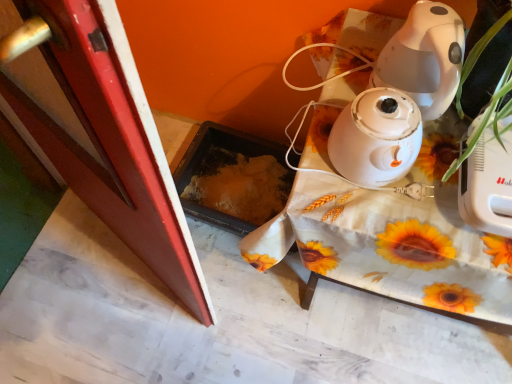
Question: Is green leafy plant at right placed right next to smooth red screen door at left?

Choices:
 (A) yes
 (B) no

Answer: (B)

Question: Is green leafy plant at right closer to camera compared to smooth red screen door at left?

Choices:
 (A) yes
 (B) no

Answer: (A)

Question: Is green leafy plant at right smaller than smooth red screen door at left?

Choices:
 (A) yes
 (B) no

Answer: (A)

Question: Is smooth red screen door at left located within green leafy plant at right?

Choices:
 (A) no
 (B) yes

Answer: (A)

Question: From the image's perspective, is green leafy plant at right located above smooth red screen door at left?

Choices:
 (A) no
 (B) yes

Answer: (B)

Question: Is green leafy plant at right positioned behind smooth red screen door at left?

Choices:
 (A) no
 (B) yes

Answer: (A)

Question: Considering the relative sizes of white fabric-covered table at upper right and smooth red screen door at left in the image provided, is white fabric-covered table at upper right wider than smooth red screen door at left?

Choices:
 (A) no
 (B) yes

Answer: (B)

Question: From the image's perspective, is white fabric-covered table at upper right on smooth red screen door at left?

Choices:
 (A) no
 (B) yes

Answer: (A)

Question: Is white fabric-covered table at upper right smaller than smooth red screen door at left?

Choices:
 (A) no
 (B) yes

Answer: (A)

Question: Considering the relative sizes of white fabric-covered table at upper right and smooth red screen door at left in the image provided, is white fabric-covered table at upper right bigger than smooth red screen door at left?

Choices:
 (A) no
 (B) yes

Answer: (B)

Question: Is white fabric-covered table at upper right oriented away from smooth red screen door at left?

Choices:
 (A) yes
 (B) no

Answer: (B)

Question: Is smooth red screen door at left inside white fabric-covered table at upper right?

Choices:
 (A) no
 (B) yes

Answer: (A)

Question: Is smooth red screen door at left positioned beyond the bounds of white glossy humidifier at center?

Choices:
 (A) no
 (B) yes

Answer: (B)